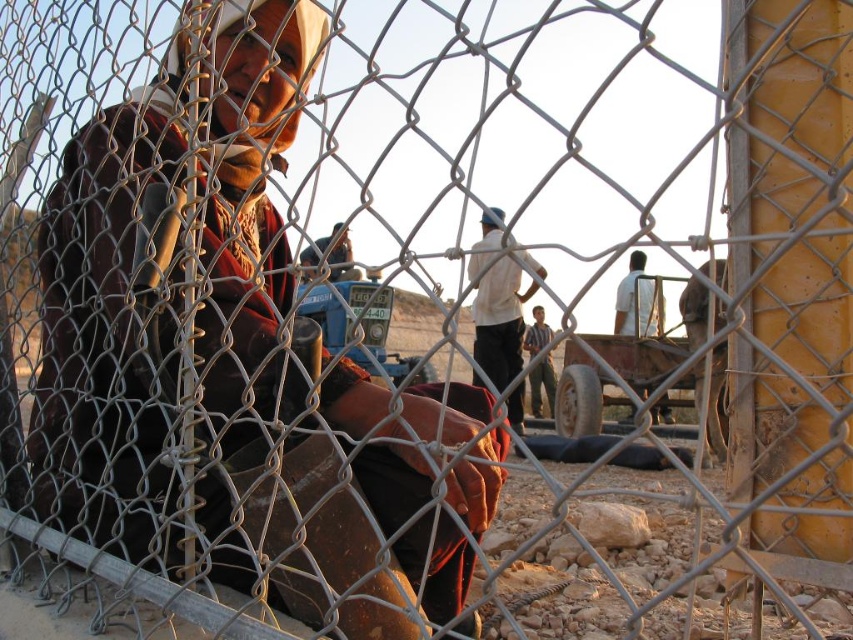
Question: Is white cotton shirt at center to the left of striped fabric shirt at center from the viewer's perspective?

Choices:
 (A) yes
 (B) no

Answer: (A)

Question: Which object appears farthest from the camera in this image?

Choices:
 (A) striped fabric shirt at center
 (B) white cotton shirt at center

Answer: (A)

Question: Does white cotton shirt at center come behind striped fabric shirt at center?

Choices:
 (A) yes
 (B) no

Answer: (B)

Question: Can you confirm if white cotton shirt at center is wider than striped fabric shirt at center?

Choices:
 (A) yes
 (B) no

Answer: (B)

Question: Among these objects, which one is farthest from the camera?

Choices:
 (A) striped fabric shirt at center
 (B) white cotton shirt at center

Answer: (A)